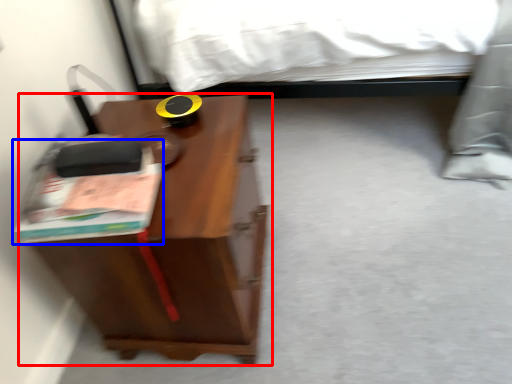
Question: Which object is further to the camera taking this photo, nightstand (highlighted by a red box) or paperback book (highlighted by a blue box)?

Choices:
 (A) nightstand
 (B) paperback book

Answer: (A)